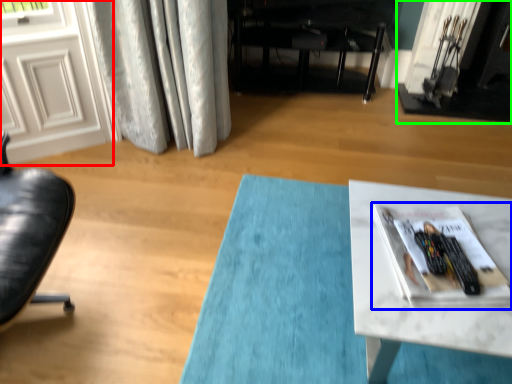
Question: Which object is the closest to the screen door (highlighted by a red box)? Choose among these: magazine (highlighted by a blue box) or fireplace (highlighted by a green box).

Choices:
 (A) magazine
 (B) fireplace

Answer: (A)